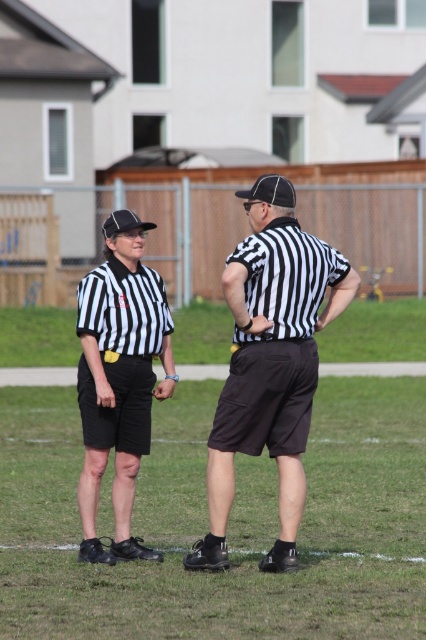
Is black striped shirt at right shorter than matte black referee shirt at left?

In fact, black striped shirt at right may be taller than matte black referee shirt at left.

Is point (316, 372) farther from viewer compared to point (129, 524)?

No, it is in front of (129, 524).

What do you see at coordinates (270, 362) in the screenshot? I see `black striped shirt at right` at bounding box center [270, 362].

The image size is (426, 640). I want to click on black striped shirt at right, so click(x=270, y=362).